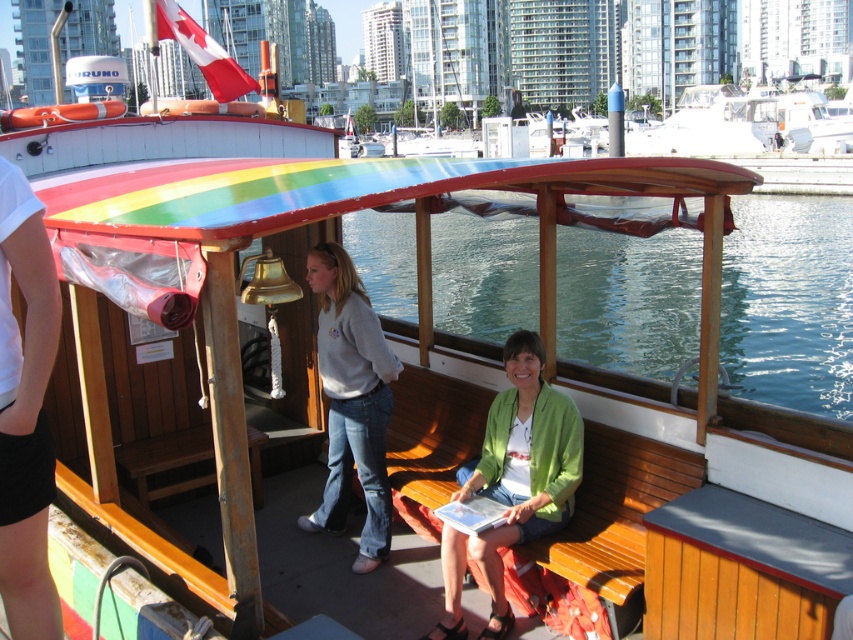
Between transparent glass water at center and green fabric jacket at center, which one is positioned higher?

transparent glass water at center is higher up.

Is transparent glass water at center below green fabric jacket at center?

Incorrect, transparent glass water at center is not positioned below green fabric jacket at center.

At what (x,y) coordinates should I click in order to perform the action: click on transparent glass water at center. Please return your answer as a coordinate pair (x, y). The width and height of the screenshot is (853, 640). Looking at the image, I should click on (788, 301).

Is green fabric jacket at center positioned at the back of gray sweatshirt at center?

No, it is not.

Does point (566, 504) come in front of point (325, 301)?

Yes, it is in front of point (325, 301).

Between point (572, 496) and point (345, 381), which one is positioned in front?

Positioned in front is point (572, 496).

The height and width of the screenshot is (640, 853). I want to click on green fabric jacket at center, so click(x=514, y=481).

Who is positioned more to the right, transparent glass water at center or gray sweatshirt at center?

transparent glass water at center

Is transparent glass water at center further to camera compared to gray sweatshirt at center?

No.

The image size is (853, 640). Identify the location of transparent glass water at center. (788, 301).

Image resolution: width=853 pixels, height=640 pixels. In order to click on transparent glass water at center in this screenshot , I will do `click(788, 301)`.